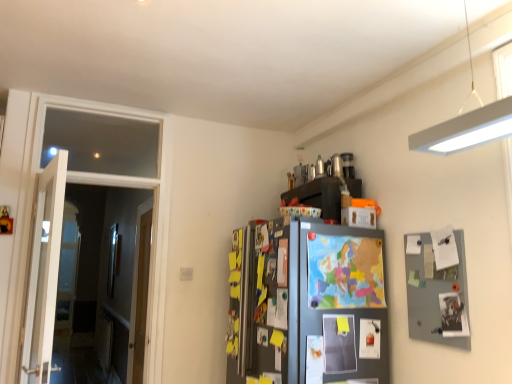
Question: Considering the positions of point (346, 258) and point (300, 188), is point (346, 258) closer or farther from the camera than point (300, 188)?

Choices:
 (A) farther
 (B) closer

Answer: (B)

Question: Considering the relative positions of colorful paper map at center and matte black cabinet at upper right in the image provided, is colorful paper map at center to the left or to the right of matte black cabinet at upper right?

Choices:
 (A) left
 (B) right

Answer: (B)

Question: Based on their relative distances, which object is nearer to the wooden door at left, which ranks as the second door in front-to-back order?

Choices:
 (A) clear glass door at left
 (B) white wooden door at left, the 1th door viewed from the front
 (C) matte black cabinet at upper right
 (D) colorful paper map at center

Answer: (A)

Question: Estimate the real-world distances between objects in this image. Which object is farther from the wooden door at left, which ranks as the second door in front-to-back order?

Choices:
 (A) clear glass door at left
 (B) colorful paper map at center
 (C) matte black cabinet at upper right
 (D) white wooden door at left, the 1th door viewed from the front

Answer: (B)